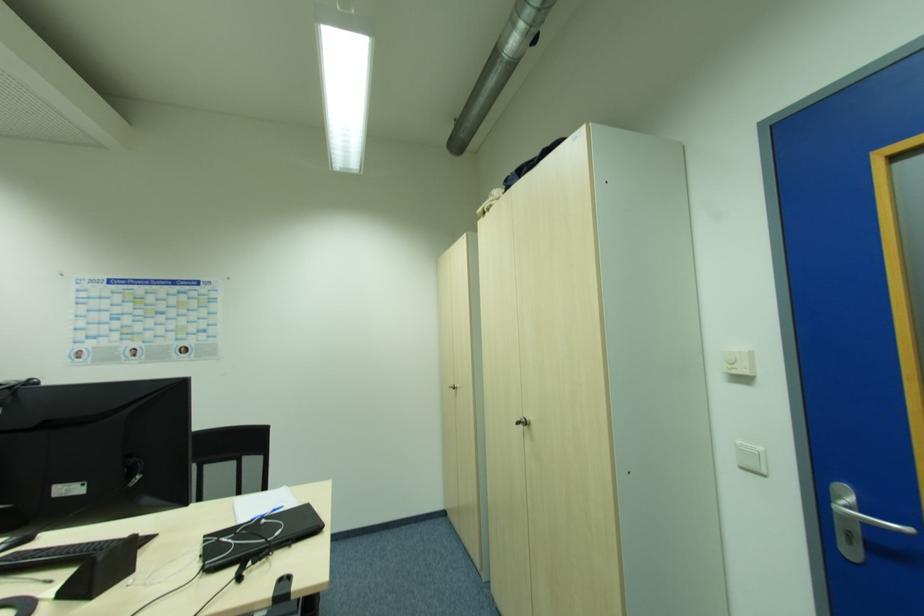
Find where to pull the silver door handle. Please return your answer as a coordinate pair (x, y).

(860, 511)